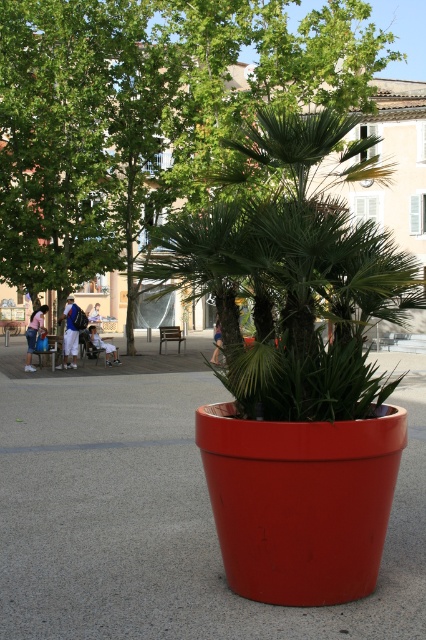
Question: From the image, what is the correct spatial relationship of denim jacket at left in relation to light blue denim jeans at center?

Choices:
 (A) right
 (B) left

Answer: (B)

Question: Among these objects, which one is farthest from the camera?

Choices:
 (A) denim jacket at left
 (B) white cotton shirt at center
 (C) light blue denim shorts at center

Answer: (C)

Question: Does green leafy tree at center have a smaller size compared to denim shorts at left?

Choices:
 (A) no
 (B) yes

Answer: (A)

Question: Which of the following is the closest to the observer?

Choices:
 (A) (365, 38)
 (B) (95, 304)

Answer: (A)

Question: Does green leafy tree at center appear under denim jacket at left?

Choices:
 (A) no
 (B) yes

Answer: (A)

Question: Among these objects, which one is nearest to the camera?

Choices:
 (A) white cotton shirt at center
 (B) light blue denim shorts at center

Answer: (A)